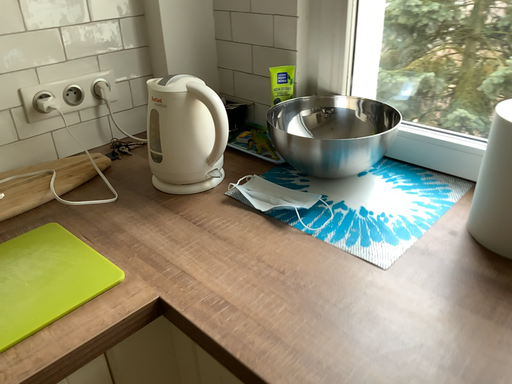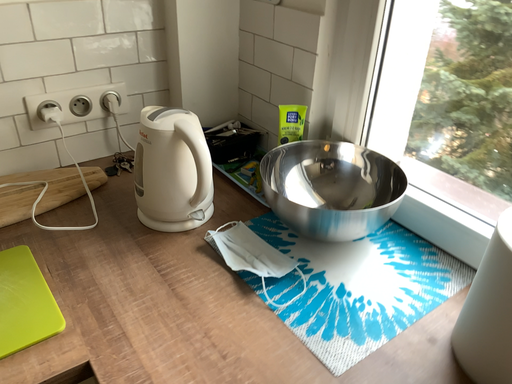
Question: How did the camera likely rotate when shooting the video?

Choices:
 (A) rotated right
 (B) rotated left

Answer: (B)